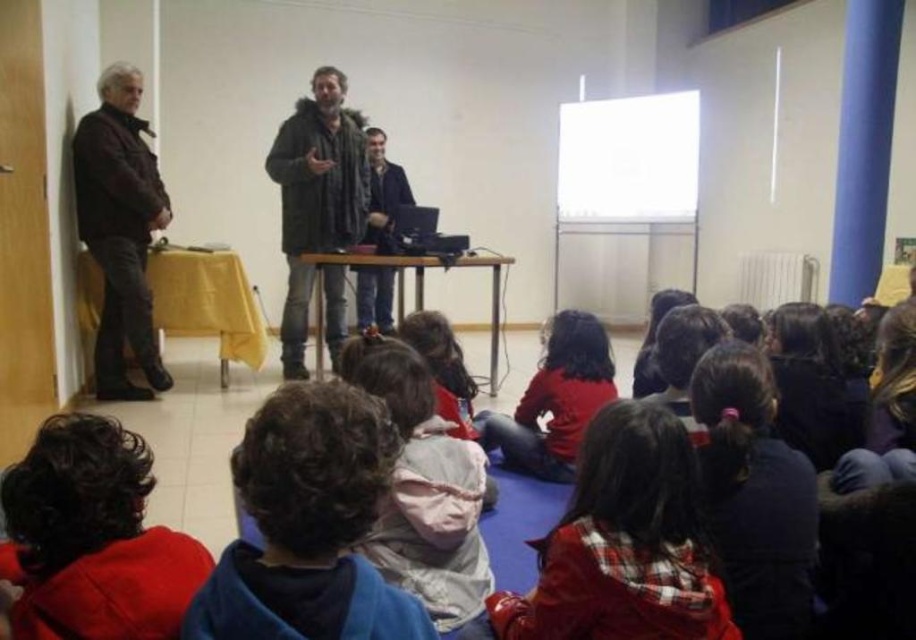
Question: Which of the following is the farthest from the observer?

Choices:
 (A) white cotton jacket at center
 (B) red cotton shirt at center
 (C) dark blue fabric jacket at center
 (D) dark gray textured jacket at center

Answer: (D)

Question: Can you confirm if dark blue fleece at center is bigger than red fleece jacket at lower left?

Choices:
 (A) yes
 (B) no

Answer: (B)

Question: Where is red fleece jacket at lower left located in relation to white cotton jacket at center in the image?

Choices:
 (A) right
 (B) left

Answer: (B)

Question: Estimate the real-world distances between objects in this image. Which object is closer to the white cotton jacket at center?

Choices:
 (A) red cotton shirt at center
 (B) dark brown leather jacket at left

Answer: (A)

Question: Can you confirm if red fleece jacket at lower left is positioned to the left of white cotton jacket at center?

Choices:
 (A) yes
 (B) no

Answer: (A)

Question: Which object is farther from the camera taking this photo?

Choices:
 (A) dark brown leather jacket at left
 (B) white cotton jacket at center

Answer: (A)